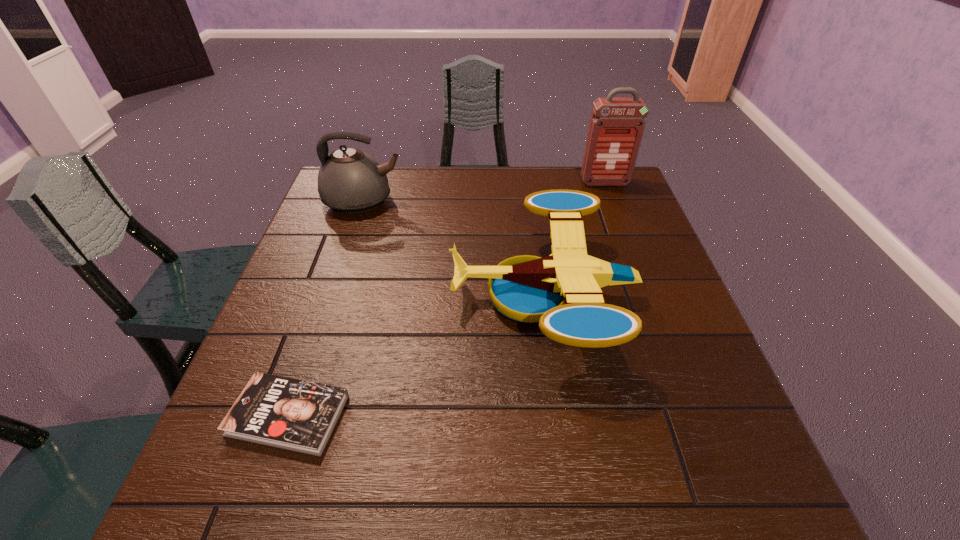
The height and width of the screenshot is (540, 960). I want to click on free space at the right edge of the desktop, so click(x=659, y=325).

Find the location of a particular element. This screenshot has height=540, width=960. vacant point at the far right corner is located at coordinates (615, 191).

This screenshot has height=540, width=960. What are the coordinates of `free space between the book and the third tallest object` in the screenshot? It's located at [416, 355].

This screenshot has width=960, height=540. I want to click on free space between the first-aid kit and the kettle, so tap(484, 192).

This screenshot has width=960, height=540. I want to click on free space that is in between the second tallest object and the book, so click(326, 308).

Find the location of a particular element. The height and width of the screenshot is (540, 960). empty location between the second tallest object and the shortest object is located at coordinates tap(326, 308).

Locate an element on the screen. Image resolution: width=960 pixels, height=540 pixels. vacant space that is in between the kettle and the first-aid kit is located at coordinates (484, 192).

The width and height of the screenshot is (960, 540). Identify the location of vacant area between the shortest object and the third tallest object. (416, 355).

At what (x,y) coordinates should I click in order to perform the action: click on object that ranks as the third closest to the kettle. Please return your answer as a coordinate pair (x, y). Looking at the image, I should click on (616, 128).

I want to click on object that stands as the second closest to the drone, so click(292, 414).